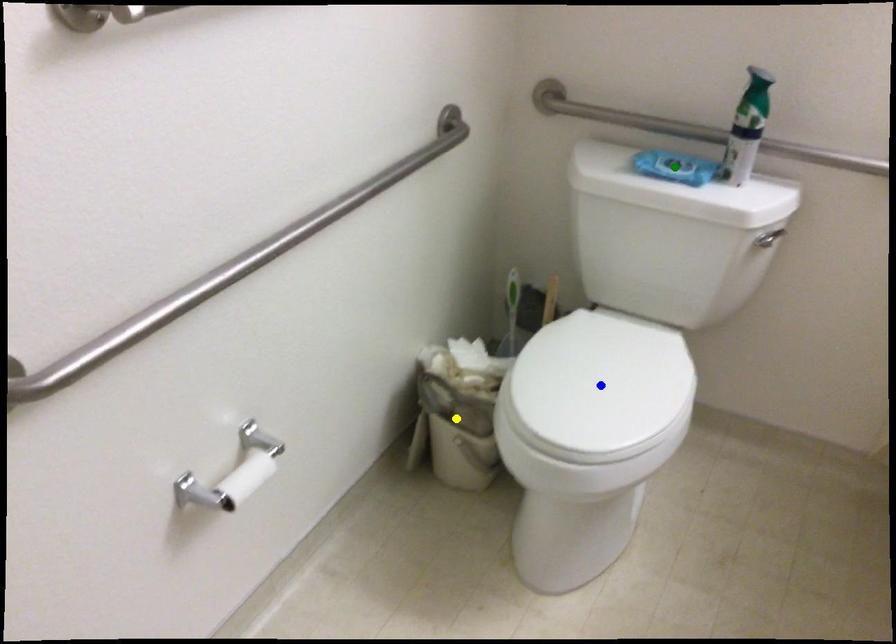
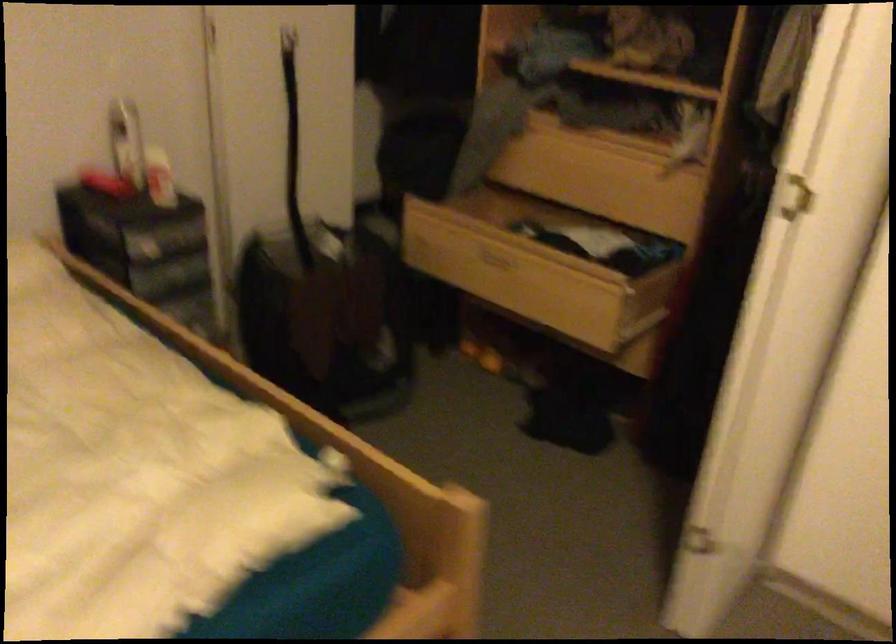
I am providing you with two images of the same scene from different viewpoints. Three points are marked in image1. Which point corresponds to a part or object that is occluded in image2?In image1, three points are marked. Which of them correspond to a part or object that is occluded in image2?Among the three points shown in image1, which one corresponds to a part or object that is no longer visible due to occlusion in image2?

yellow point, blue point, green point cannot be seen in image2.